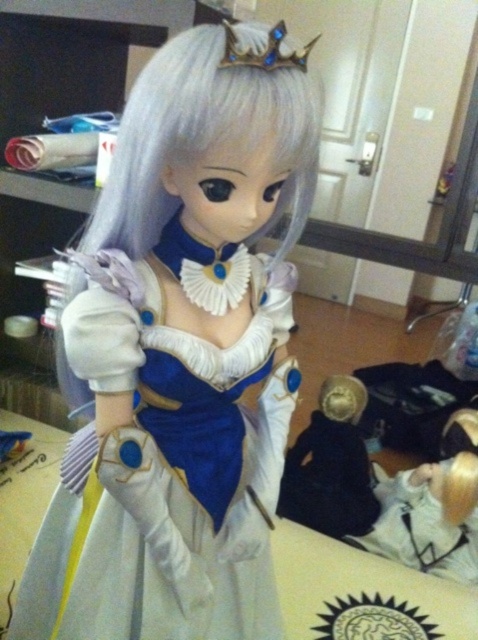
Question: Is satin white dress at center above black matte doll at lower right?

Choices:
 (A) yes
 (B) no

Answer: (A)

Question: Which of the following is the closest to the observer?

Choices:
 (A) satin white dress at center
 (B) black matte doll at lower right

Answer: (A)

Question: Which point is farther from the camera taking this photo?

Choices:
 (A) (362, 477)
 (B) (252, 262)

Answer: (A)

Question: Can you confirm if satin white dress at center is bigger than black matte doll at lower right?

Choices:
 (A) no
 (B) yes

Answer: (B)

Question: Can you confirm if satin white dress at center is smaller than black matte doll at lower right?

Choices:
 (A) no
 (B) yes

Answer: (A)